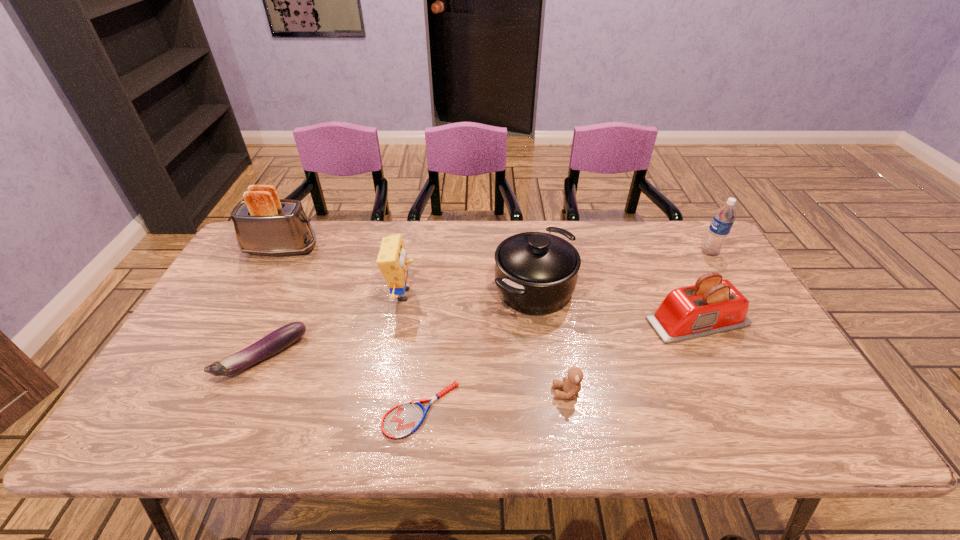
Where is `the taller toaster`? the taller toaster is located at coordinates (264, 224).

This screenshot has height=540, width=960. Identify the location of the farther toaster. (264, 224).

This screenshot has height=540, width=960. What are the coordinates of `water bottle` in the screenshot? It's located at (722, 222).

Locate an element on the screen. This screenshot has width=960, height=540. saucepan is located at coordinates click(536, 273).

Locate an element on the screen. Image resolution: width=960 pixels, height=540 pixels. sponge is located at coordinates (392, 261).

Locate an element on the screen. the right toaster is located at coordinates (712, 305).

Locate an element on the screen. the shorter toaster is located at coordinates (712, 305).

Locate an element on the screen. the sixth tallest object is located at coordinates (571, 384).

Locate an element on the screen. This screenshot has height=540, width=960. eggplant is located at coordinates (271, 344).

This screenshot has width=960, height=540. I want to click on tennis racket, so click(402, 420).